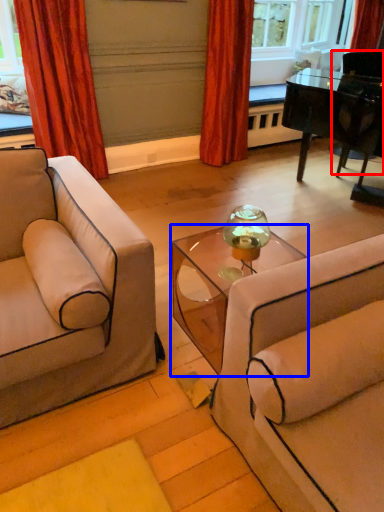
Question: Which of the following is the farthest to the observer, armchair (highlighted by a red box) or table (highlighted by a blue box)?

Choices:
 (A) armchair
 (B) table

Answer: (A)